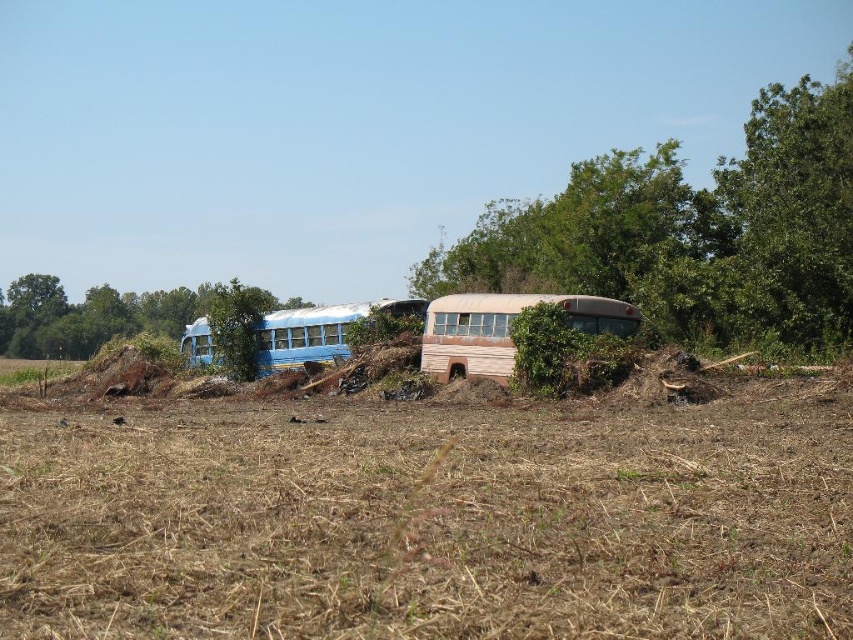
You are a hiker who has stumbled upon this abandoned area. You notice a green leafy tree at left and a rusty wood school bus at center. Which object is taller?

The green leafy tree at left is taller than the rusty wood school bus at center.

You are standing in the field with the two abandoned buses. You notice two points marked in the scene. Which point is closer to you, point (686, 579) or point (281, 320)?

Point (686, 579) is closer to the viewer than point (281, 320).